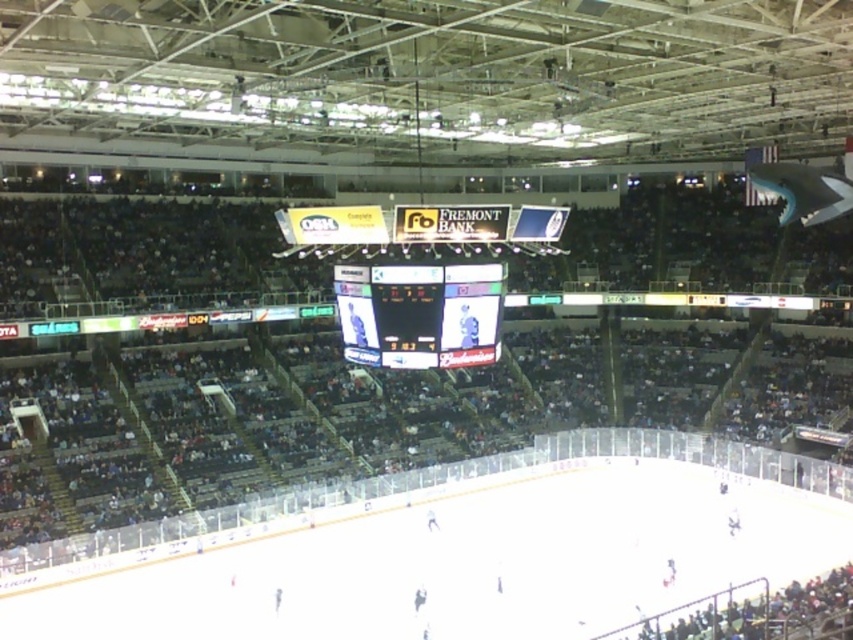
You are a photographer standing at the back of the arena, and you want to take a photo of both the white smooth ice at center and the black glossy scoreboard at center. Which object will appear larger in your photo?

The white smooth ice at center will appear larger in the photo because it is closer to the photographer than the black glossy scoreboard at center, which is farther away.

You are an ice hockey player standing at the edge of the arena. You need to skate to the center of the rink to join your teammates. According to the arena layout, where is the white smooth ice at center located?

The white smooth ice at center is located at point (454, 561).

You are a spectator sitting in the stands and want to watch the hockey game. Which object is closer to the center of the arena, the white smooth ice at center or the black glossy scoreboard at center?

The white smooth ice at center is closer to the center of the arena because it is positioned to the right of the black glossy scoreboard at center, which is already at the center.